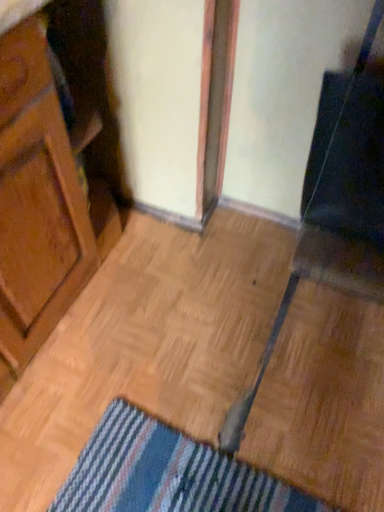
I want to click on wooden cabinet at left, so click(x=41, y=205).

What do you see at coordinates (41, 205) in the screenshot? This screenshot has height=512, width=384. I see `wooden cabinet at left` at bounding box center [41, 205].

At what (x,y) coordinates should I click in order to perform the action: click on wooden cabinet at left. Please return your answer as a coordinate pair (x, y). Image resolution: width=384 pixels, height=512 pixels. Looking at the image, I should click on (41, 205).